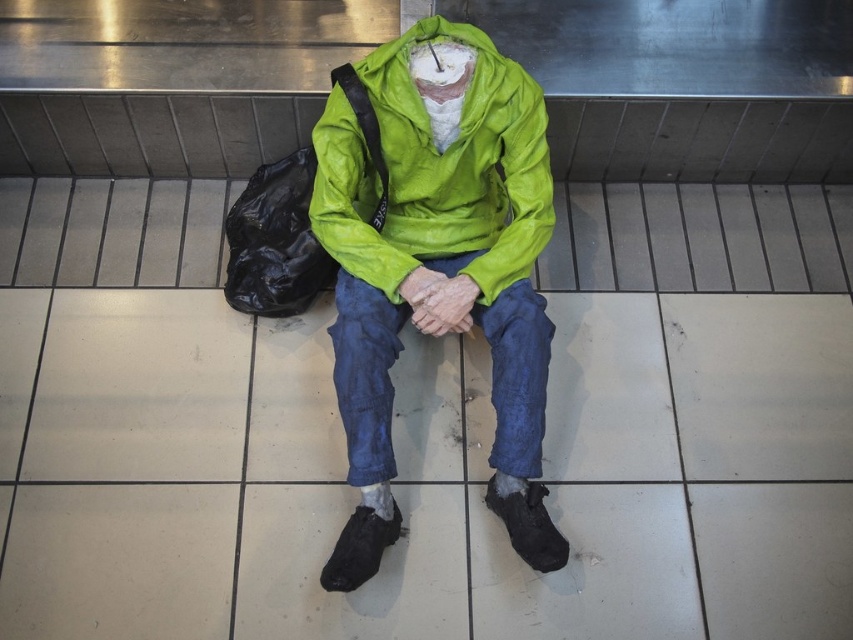
Question: Is matte green jacket at center above denim at center?

Choices:
 (A) yes
 (B) no

Answer: (A)

Question: Which is nearer to the black plastic bag at lower left?

Choices:
 (A) green tarpaulin jacket at center
 (B) matte green jacket at center

Answer: (A)

Question: Which point is farther from the camera taking this photo?

Choices:
 (A) (253, 268)
 (B) (508, 113)
 (C) (436, 193)

Answer: (A)

Question: Which of these objects is positioned farthest from the green tarpaulin jacket at center?

Choices:
 (A) matte green jacket at center
 (B) black plastic bag at lower left
 (C) denim at center

Answer: (B)

Question: Does matte green jacket at center have a larger size compared to black plastic bag at lower left?

Choices:
 (A) yes
 (B) no

Answer: (A)

Question: Is matte green jacket at center smaller than denim at center?

Choices:
 (A) no
 (B) yes

Answer: (A)